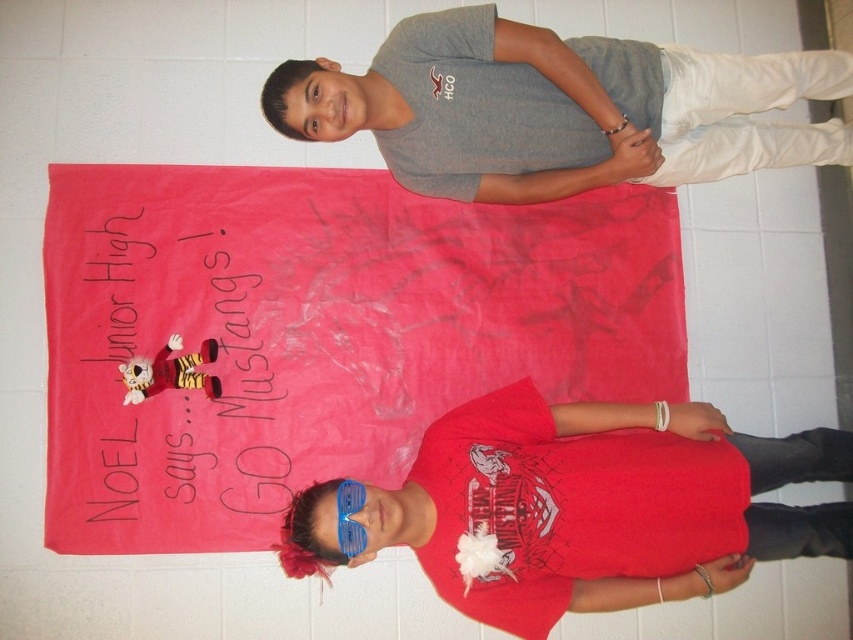
You are organizing a school event and need to display the handwritten paper at center and the blue plastic goggles at center on a bulletin board. Given their sizes, which object should be placed higher to ensure both are visible without overlapping?

The handwritten paper at center is larger than the blue plastic goggles at center, so placing the paper higher will allow both to be visible without overlapping.